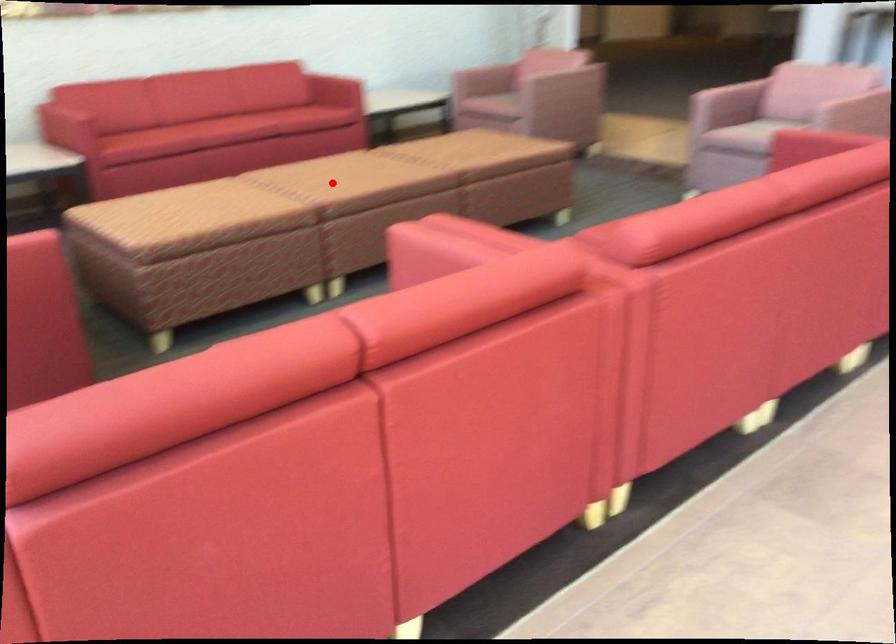
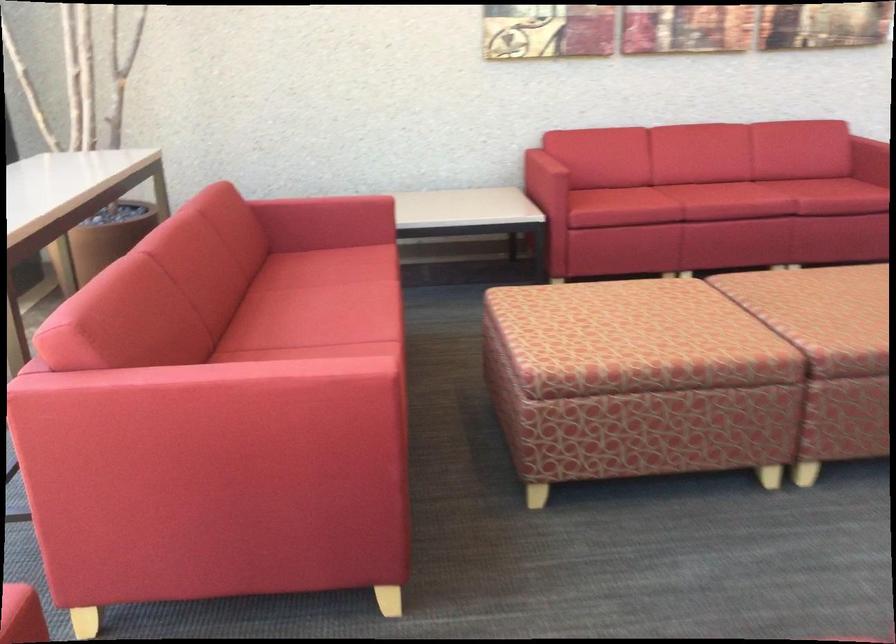
Question: I am providing you with two images of the same scene from different viewpoints. Given a red point in image1, look at the same physical point in image2. Is it:

Choices:
 (A) Closer to the viewpoint
 (B) Farther from the viewpoint

Answer: (A)